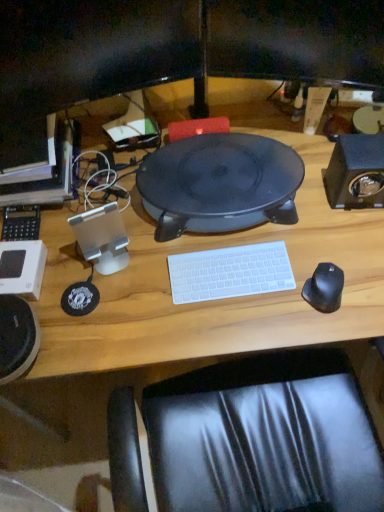
Locate an element on the screen. The height and width of the screenshot is (512, 384). free point to the right of black matte speaker at center is located at coordinates (323, 193).